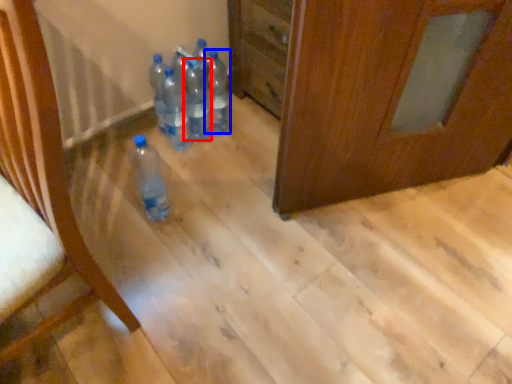
Question: Which of the following is the closest to the observer, bottle (highlighted by a red box) or bottle (highlighted by a blue box)?

Choices:
 (A) bottle
 (B) bottle

Answer: (A)